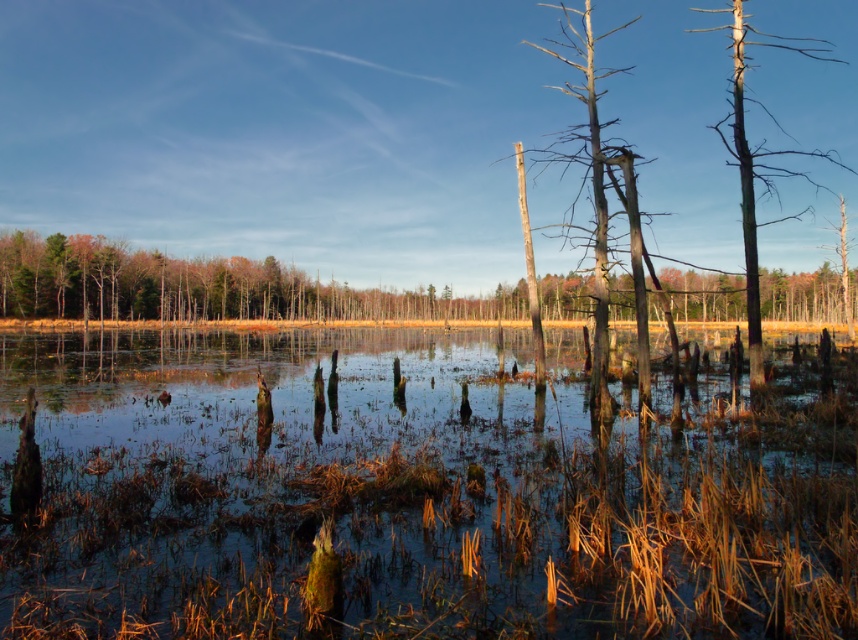
Question: Can you confirm if clear water at center is positioned to the left of brown wood tree at center?

Choices:
 (A) no
 (B) yes

Answer: (B)

Question: Can you confirm if clear water at center is smaller than dark brown wood tree at upper right?

Choices:
 (A) yes
 (B) no

Answer: (A)

Question: Considering the real-world distances, which object is closest to the clear water at center?

Choices:
 (A) brown wood tree at center
 (B) dark brown wood tree at upper right

Answer: (B)

Question: Where is brown wood tree at center located in relation to dark brown wood tree at upper right in the image?

Choices:
 (A) above
 (B) below

Answer: (A)

Question: Which object is the closest to the brown wood tree at center?

Choices:
 (A) clear water at center
 (B) dark brown wood tree at upper right

Answer: (B)

Question: Estimate the real-world distances between objects in this image. Which object is closer to the clear water at center?

Choices:
 (A) brown wood tree at center
 (B) dark brown wood tree at upper right

Answer: (B)